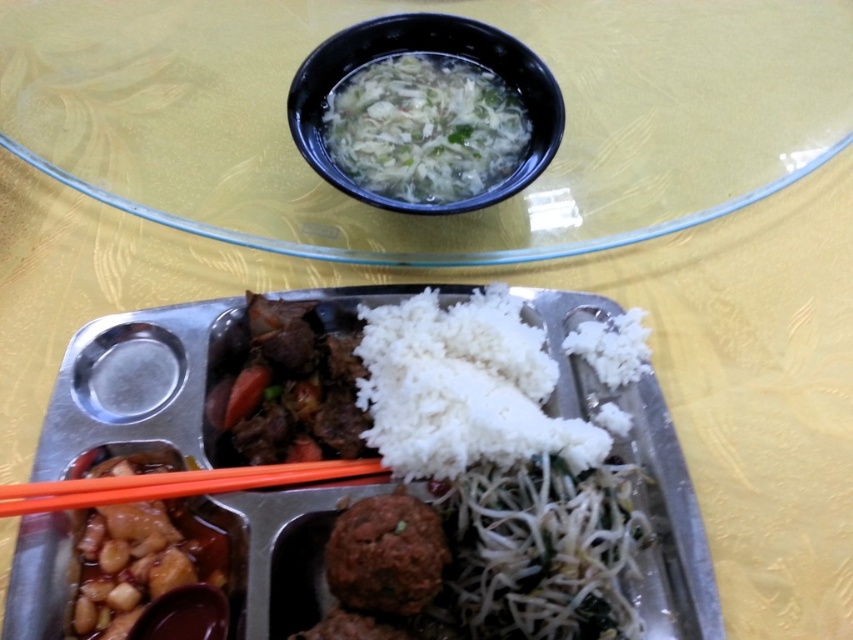
You are looking at the metallic tray on the glass table. There are two points marked on the tray at coordinates point (132, 61) and point (503, 403). If you were to reach out to touch both points with your finger, which point would require you to extend your hand further away from your body?

Point (503, 403) would require extending your hand further away from your body because it is closer to the viewer than point (132, 61). Wait, no, the description says the first point is further to the camera than the second. Hmm, maybe I need to check again. The Objects Description states that point (132, 61) is further to the camera than point (503, 403). So if you have to reach both points, the one further away from you would be the second point. Wait, the description says point A is further to

You are a food delivery person who needs to ensure the soup in the transparent glass bowl at upper center stays above the rice in the white matte rice at center during transport. Based on the image, is this possible?

The transparent glass bowl at upper center is taller than white matte rice at center, so the soup should remain above the rice during transport as the bowl is taller.